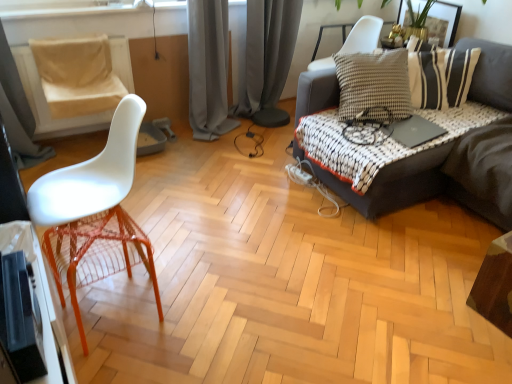
This screenshot has width=512, height=384. Identify the location of free area behind white plastic chair at left. (168, 211).